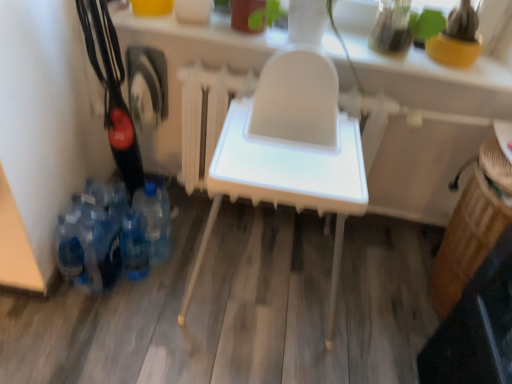
Find the location of `unoccupied region to the right of white plastic high chair at center`. unoccupied region to the right of white plastic high chair at center is located at coordinates (368, 312).